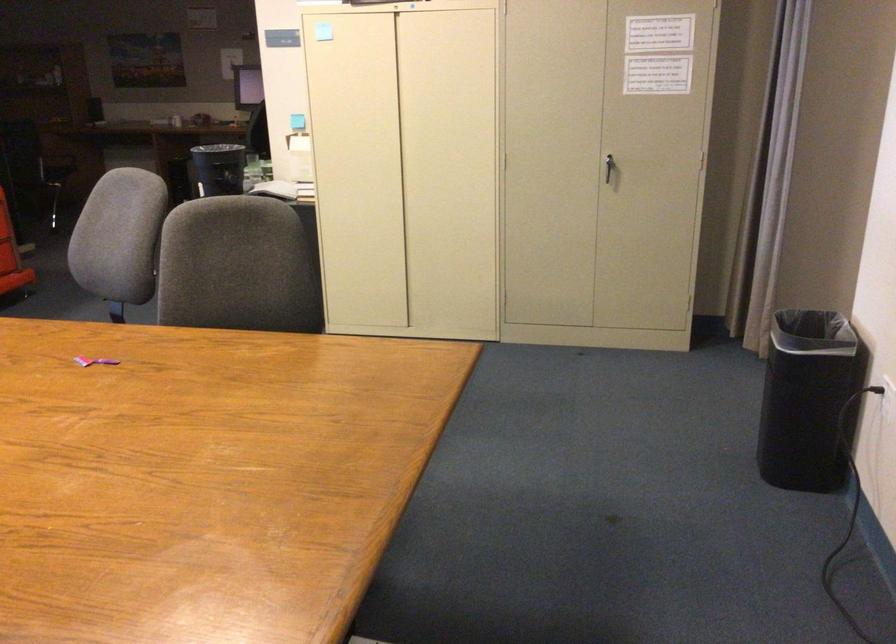
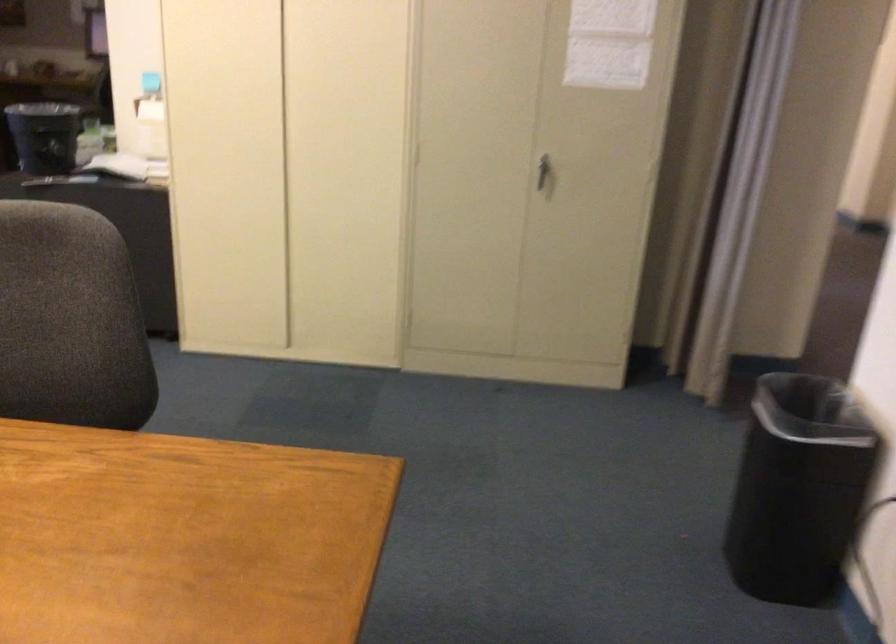
Question: The camera is either moving clockwise (left) or counter-clockwise (right) around the object. The first image is from the beginning of the video and the second image is from the end. Is the camera moving left or right when shooting the video?

Choices:
 (A) Left
 (B) Right

Answer: (A)